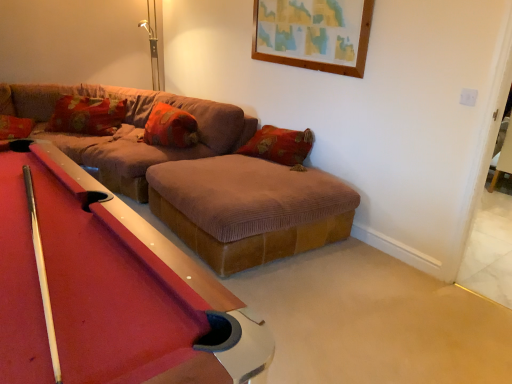
What do you see at coordinates (106, 289) in the screenshot? This screenshot has height=384, width=512. I see `rubberized felt pool table at center` at bounding box center [106, 289].

This screenshot has height=384, width=512. Find the location of `corduroy pillow at upper left, marked as the second pillow in a right-to-left arrangement`. corduroy pillow at upper left, marked as the second pillow in a right-to-left arrangement is located at coordinates 87,115.

At what (x,y) coordinates should I click in order to perform the action: click on brown corduroy couch at center. Please return your answer as a coordinate pair (x, y). Image resolution: width=512 pixels, height=384 pixels. Looking at the image, I should click on (128, 130).

Considering the relative sizes of corduroy pillow at upper left, marked as the second pillow in a right-to-left arrangement, and rubberized felt pool table at center in the image provided, is corduroy pillow at upper left, marked as the second pillow in a right-to-left arrangement, shorter than rubberized felt pool table at center?

Correct, corduroy pillow at upper left, marked as the second pillow in a right-to-left arrangement, is not as tall as rubberized felt pool table at center.

Does point (86, 97) appear closer or farther from the camera than point (103, 300)?

Point (86, 97) is farther from the camera than point (103, 300).

Considering the relative positions of corduroy pillow at upper left, marked as the second pillow in a right-to-left arrangement, and rubberized felt pool table at center in the image provided, is corduroy pillow at upper left, marked as the second pillow in a right-to-left arrangement, to the right of rubberized felt pool table at center from the viewer's perspective?

No, corduroy pillow at upper left, marked as the second pillow in a right-to-left arrangement, is not to the right of rubberized felt pool table at center.

Is corduroy pillow at upper left, which is the 1th pillow in left-to-right order, in contact with rubberized felt pool table at center?

No, corduroy pillow at upper left, which is the 1th pillow in left-to-right order, is not next to rubberized felt pool table at center.

Consider the image. Is rubberized felt pool table at center to the right of brown corduroy footrest at center from the viewer's perspective?

In fact, rubberized felt pool table at center is to the left of brown corduroy footrest at center.

The height and width of the screenshot is (384, 512). Identify the location of the footrest that appears above the rubberized felt pool table at center (from the image's perspective). (249, 209).

Considering the points (26, 378) and (300, 183), which point is in front, point (26, 378) or point (300, 183)?

The point (26, 378) is more forward.

Can you confirm if rubberized felt pool table at center is wider than brown corduroy footrest at center?

In fact, rubberized felt pool table at center might be narrower than brown corduroy footrest at center.

Would you say brown corduroy footrest at center contains rubberized felt pool table at center?

No.

Can you confirm if brown corduroy footrest at center is smaller than rubberized felt pool table at center?

Yes, brown corduroy footrest at center is smaller than rubberized felt pool table at center.

The height and width of the screenshot is (384, 512). Identify the location of footrest below the rubberized felt pool table at center (from a real-world perspective). (249, 209).

Which is behind, point (244, 182) or point (128, 364)?

Positioned behind is point (244, 182).

From a real-world perspective, which pillow is the 2nd one above the brown corduroy footrest at center? Please provide its 2D coordinates.

[(87, 115)]

Which of these two, corduroy pillow at upper left, which is the 1th pillow in left-to-right order, or brown corduroy footrest at center, is thinner?

corduroy pillow at upper left, which is the 1th pillow in left-to-right order.

Could you tell me if corduroy pillow at upper left, which is the 1th pillow in left-to-right order, is turned towards brown corduroy footrest at center?

No, corduroy pillow at upper left, which is the 1th pillow in left-to-right order, is not turned towards brown corduroy footrest at center.

From the image's perspective, is corduroy pillow at upper left, marked as the second pillow in a right-to-left arrangement, beneath brown corduroy couch at center?

No, from the image's perspective, corduroy pillow at upper left, marked as the second pillow in a right-to-left arrangement, is not beneath brown corduroy couch at center.

Considering the positions of points (62, 106) and (47, 121), is point (62, 106) farther from camera compared to point (47, 121)?

That is False.

Is brown corduroy couch at center surrounded by corduroy pillow at upper left, which is the 1th pillow in left-to-right order?

That's incorrect, brown corduroy couch at center is not inside corduroy pillow at upper left, which is the 1th pillow in left-to-right order.

Which is more to the right, corduroy pillow at upper left, marked as the second pillow in a right-to-left arrangement, or brown corduroy couch at center?

brown corduroy couch at center is more to the right.

What's the angular difference between rubberized felt pool table at center and corduroy pillow at upper left, marked as the second pillow in a right-to-left arrangement,'s facing directions?

There is a 123-degree angle between the facing directions of rubberized felt pool table at center and corduroy pillow at upper left, marked as the second pillow in a right-to-left arrangement.

Is rubberized felt pool table at center not within corduroy pillow at upper left, which is the 1th pillow in left-to-right order?

Absolutely, rubberized felt pool table at center is external to corduroy pillow at upper left, which is the 1th pillow in left-to-right order.

From a real-world perspective, which object rests below the other?

rubberized felt pool table at center is physically lower.

Could you tell me if rubberized felt pool table at center is facing corduroy pillow at upper left, marked as the second pillow in a right-to-left arrangement?

No, rubberized felt pool table at center is not turned towards corduroy pillow at upper left, marked as the second pillow in a right-to-left arrangement.

What's the angular difference between velvet orange pillow at center, marked as the second pillow in a left-to-right arrangement, and rubberized felt pool table at center's facing directions?

164 degrees.

Is velvet orange pillow at center, marked as the second pillow in a left-to-right arrangement, in front of or behind rubberized felt pool table at center in the image?

velvet orange pillow at center, marked as the second pillow in a left-to-right arrangement, is behind rubberized felt pool table at center.

From the picture: From the image's perspective, which one is positioned lower, velvet orange pillow at center, acting as the first pillow starting from the right, or rubberized felt pool table at center?

From the image's view, rubberized felt pool table at center is below.

Identify the location of billiard table lying on the right of corduroy pillow at upper left, which is the 1th pillow in left-to-right order. (106, 289).

You are a GUI agent. You are given a task and a screenshot of the screen. Output one action in this format:
    pyautogui.click(x=<x>, y=<y>)
    Task: Click on the billiard table in front of the brown corduroy footrest at center
    The image size is (512, 384).
    Given the screenshot: What is the action you would take?
    pyautogui.click(x=106, y=289)

Looking at the image, which one is located further to velvet orange pillow at center, acting as the first pillow starting from the right, corduroy pillow at upper left, which is the 1th pillow in left-to-right order, or rubberized felt pool table at center?

Based on the image, rubberized felt pool table at center appears to be further to velvet orange pillow at center, acting as the first pillow starting from the right.

Looking at the image, which one is located closer to corduroy pillow at upper left, marked as the second pillow in a right-to-left arrangement, brown corduroy couch at center or velvet orange pillow at center, acting as the first pillow starting from the right?

brown corduroy couch at center lies closer to corduroy pillow at upper left, marked as the second pillow in a right-to-left arrangement, than the other object.

When comparing their distances from rubberized felt pool table at center, does brown corduroy footrest at center or brown corduroy couch at center seem further?

brown corduroy couch at center is further to rubberized felt pool table at center.

Based on their spatial positions, is corduroy pillow at upper left, marked as the second pillow in a right-to-left arrangement, or brown corduroy footrest at center further from rubberized felt pool table at center?

corduroy pillow at upper left, marked as the second pillow in a right-to-left arrangement, is further to rubberized felt pool table at center.

In the scene shown: Considering their positions, is rubberized felt pool table at center positioned closer to brown corduroy couch at center than velvet orange pillow at center, acting as the first pillow starting from the right?

Based on the image, velvet orange pillow at center, acting as the first pillow starting from the right, appears to be nearer to brown corduroy couch at center.

Looking at the image, which one is located closer to brown corduroy footrest at center, corduroy pillow at upper left, marked as the second pillow in a right-to-left arrangement, or rubberized felt pool table at center?

rubberized felt pool table at center is positioned closer to the anchor brown corduroy footrest at center.

Based on their spatial positions, is corduroy pillow at upper left, which is the 1th pillow in left-to-right order, or brown corduroy footrest at center closer to brown corduroy couch at center?

The object closer to brown corduroy couch at center is corduroy pillow at upper left, which is the 1th pillow in left-to-right order.

Which object lies nearer to the anchor point velvet orange pillow at center, acting as the first pillow starting from the right, brown corduroy couch at center or corduroy pillow at upper left, which is the 1th pillow in left-to-right order?

brown corduroy couch at center is closer to velvet orange pillow at center, acting as the first pillow starting from the right.

This screenshot has width=512, height=384. I want to click on the footrest positioned between rubberized felt pool table at center and corduroy pillow at upper left, marked as the second pillow in a right-to-left arrangement, from near to far, so click(249, 209).

Where is `pillow between brown corduroy couch at center and brown corduroy footrest at center in the horizontal direction`? Image resolution: width=512 pixels, height=384 pixels. pillow between brown corduroy couch at center and brown corduroy footrest at center in the horizontal direction is located at coordinates (170, 127).

Locate an element on the screen. footrest between rubberized felt pool table at center and velvet orange pillow at center, acting as the first pillow starting from the right, from front to back is located at coordinates (249, 209).

Locate an element on the screen. The image size is (512, 384). pillow between corduroy pillow at upper left, which is the 1th pillow in left-to-right order, and brown corduroy footrest at center, in the horizontal direction is located at coordinates (170, 127).